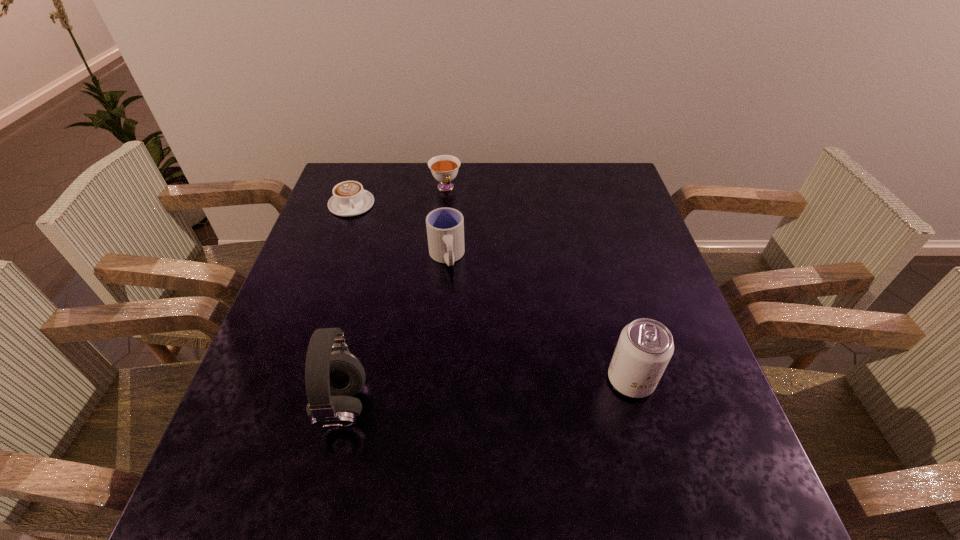
At what (x,y) coordinates should I click in order to perform the action: click on the tallest object. Please return your answer as a coordinate pair (x, y). The image size is (960, 540). Looking at the image, I should click on (333, 375).

This screenshot has width=960, height=540. In order to click on headset in this screenshot , I will do `click(333, 375)`.

This screenshot has height=540, width=960. Identify the location of soda can. (645, 346).

Locate an element on the screen. The width and height of the screenshot is (960, 540). the fourth shortest object is located at coordinates (645, 346).

The width and height of the screenshot is (960, 540). I want to click on cup, so click(445, 226).

In order to click on the third farthest object in this screenshot , I will do `click(445, 226)`.

Find the location of a particular element. This screenshot has width=960, height=540. teacup is located at coordinates (444, 168).

You are a GUI agent. You are given a task and a screenshot of the screen. Output one action in this format:
    pyautogui.click(x=<x>, y=<y>)
    Task: Click on the shortest object
    
    Given the screenshot: What is the action you would take?
    pyautogui.click(x=349, y=198)

Locate an element on the screen. Image resolution: width=960 pixels, height=540 pixels. the leftmost object is located at coordinates (349, 198).

At what (x,y) coordinates should I click in order to perform the action: click on free point located on the ear cups of the headset. Please return your answer as a coordinate pair (x, y). Looking at the image, I should click on (239, 406).